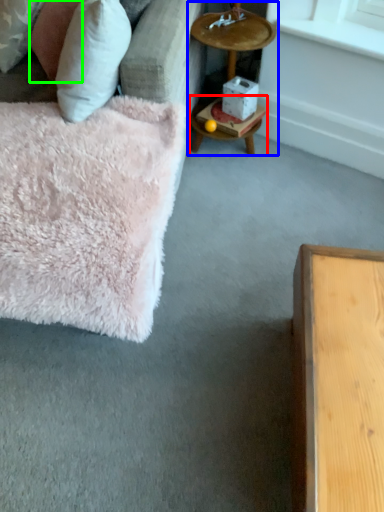
Question: Considering the real-world distances, which object is farthest from table (highlighted by a red box)? cocktail table (highlighted by a blue box) or pillow (highlighted by a green box)?

Choices:
 (A) cocktail table
 (B) pillow

Answer: (B)